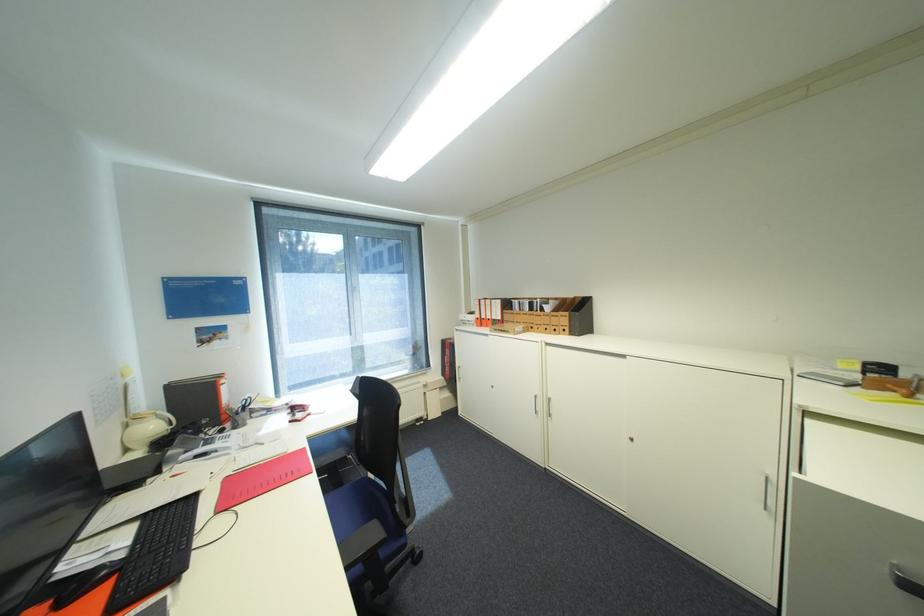
At what (x,y) coordinates should I click in order to perform the action: click on scissors handle. Please return your answer as a coordinate pair (x, y). Image resolution: width=924 pixels, height=616 pixels. Looking at the image, I should click on (244, 403).